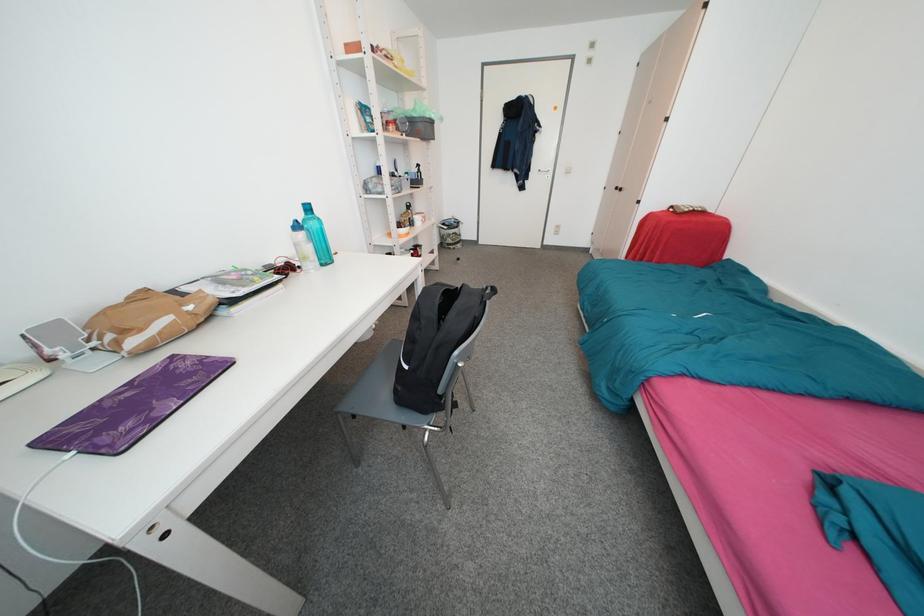
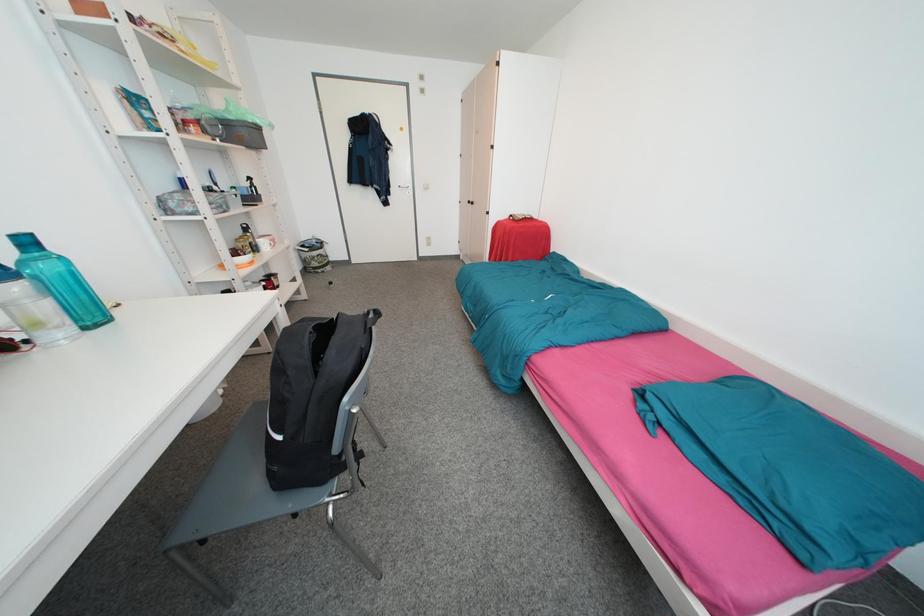
Which direction would the cameraman need to move to produce the second image?

The cameraman walked toward right, forward.